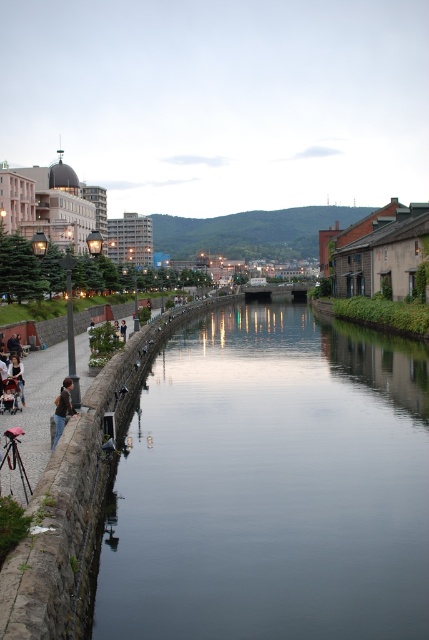
Is point (60, 401) farther from viewer compared to point (18, 358)?

No.

Does denim jacket at lower left appear under dark brown leather jacket at lower left?

Correct, denim jacket at lower left is located below dark brown leather jacket at lower left.

Is point (69, 387) more distant than point (21, 378)?

No, it is not.

Identify the location of denim jacket at lower left. The image size is (429, 640). (63, 408).

Is point (389, 349) positioned behind point (65, 384)?

Yes, it is.

I want to click on smooth concrete river at center, so click(x=271, y=484).

Locate an element on the screen. Image resolution: width=429 pixels, height=640 pixels. smooth concrete river at center is located at coordinates click(271, 484).

Does point (284, 467) lie in front of point (23, 400)?

That is True.

Where is `smooth concrete river at center`? This screenshot has width=429, height=640. smooth concrete river at center is located at coordinates point(271,484).